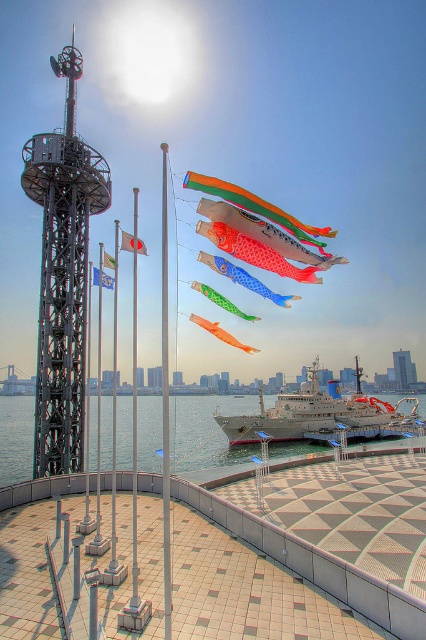
Question: Does silver metallic cruise ship at center have a lesser width compared to blue fabric flag at center?

Choices:
 (A) yes
 (B) no

Answer: (B)

Question: Estimate the real-world distances between objects in this image. Which object is closer to the green glossy kite at center?

Choices:
 (A) silver metallic pole at center
 (B) green fabric flag at center
 (C) silver metallic cruise ship at center

Answer: (A)

Question: Is transparent water at center to the left of white fabric flag at center from the viewer's perspective?

Choices:
 (A) yes
 (B) no

Answer: (B)

Question: Based on their relative distances, which object is farther from the blue glossy kite at center?

Choices:
 (A) silver metallic pole at center
 (B) orange glossy fish at upper center
 (C) white fabric flag at center

Answer: (C)

Question: From the image, what is the correct spatial relationship of orange fabric kite at upper center in relation to silver metallic pole at center?

Choices:
 (A) left
 (B) right

Answer: (B)

Question: Which point is farther to the camera?

Choices:
 (A) silver metallic pole at center
 (B) orange matte kite at center
 (C) green fabric flag at center

Answer: (B)